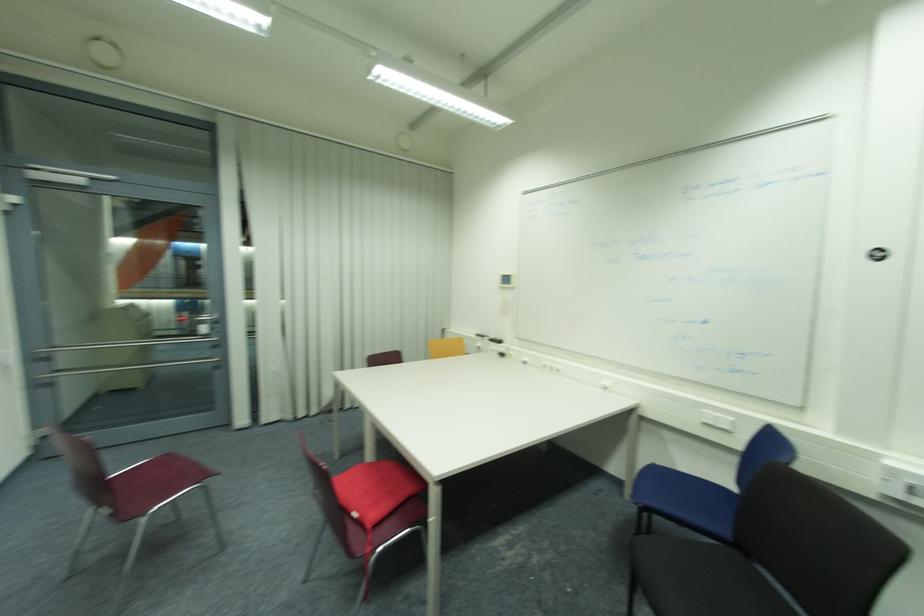
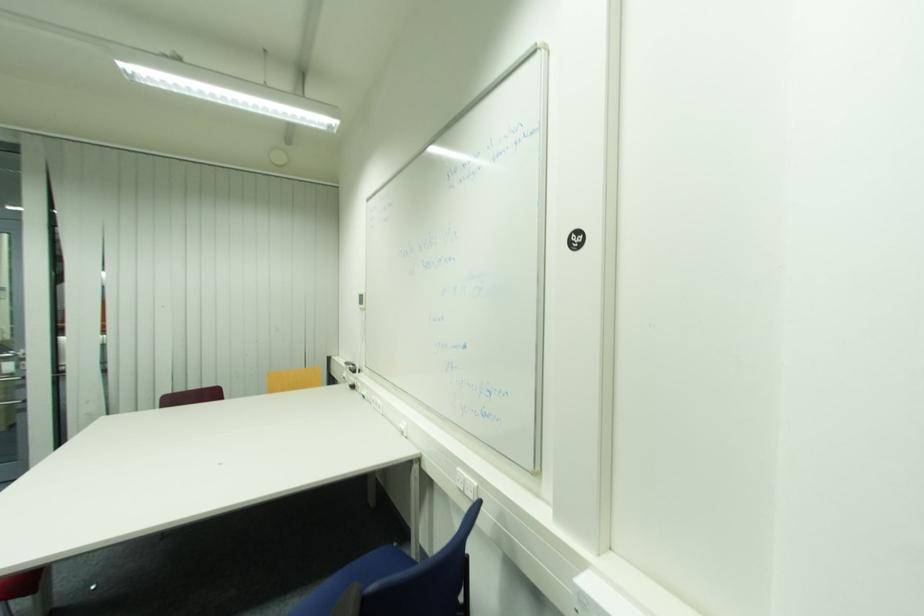
Question: What movement of the cameraman would produce the second image?

Choices:
 (A) Left
 (B) Right
 (C) Forward
 (D) Backward

Answer: (B)